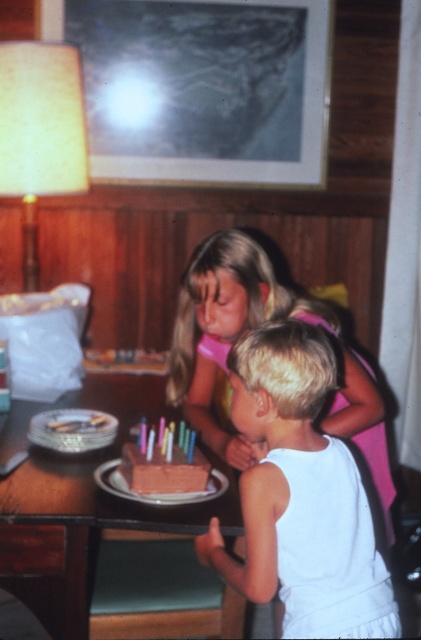
You are a guest at the birthday party and want to know which cake is taller between the chocolate cake at center and the chocolate matte cake at center. Can you tell me?

The chocolate cake at center is taller than the chocolate matte cake at center.

You are a guest at the birthday party and want to blow out the candles on the chocolate cake at center. You are currently holding the white matte tank top at center. Can you reach the cake without moving the tank top?

The distance between the white matte tank top at center and the chocolate cake at center is 11.17 inches. Since the tank top is being held, you can extend your arm to reach the cake, so yes, you can blow out the candles without moving the tank top.